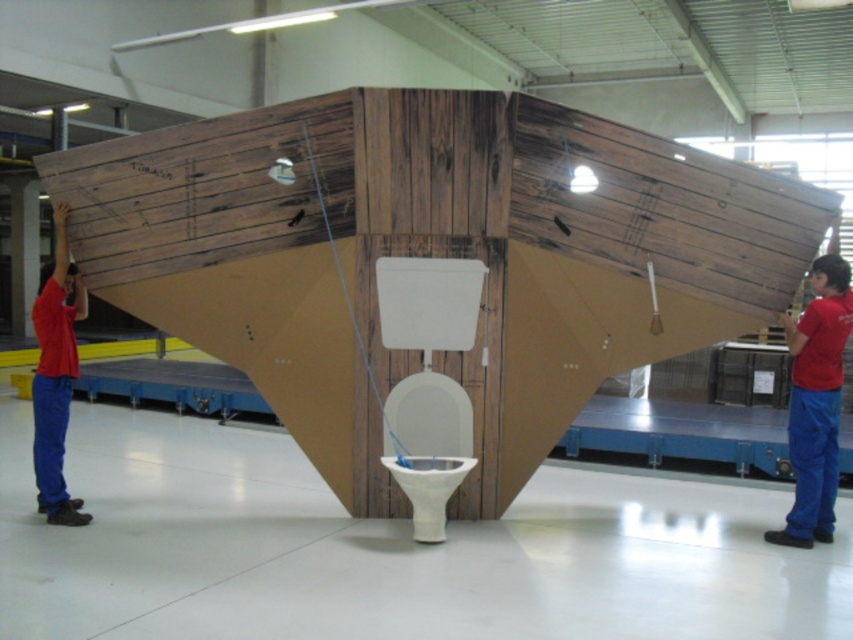
You are an artist observing the workshop scene. You notice two red shirts in the image. The first is a red cotton shirt at center, and the second is a matte red shirt at left. From your vantage point, which shirt is positioned more to the left?

The matte red shirt at left is positioned more to the left compared to the red cotton shirt at center, as the red cotton shirt at center is located to the right of the matte red shirt at left.

You are an artist observing this workshop scene. You notice two red shirts in the image. The first is the red cotton shirt at center, and the second is the matte red shirt at left. Which shirt is positioned lower in the image?

The red cotton shirt at center is positioned lower in the image as it is below the matte red shirt at left.